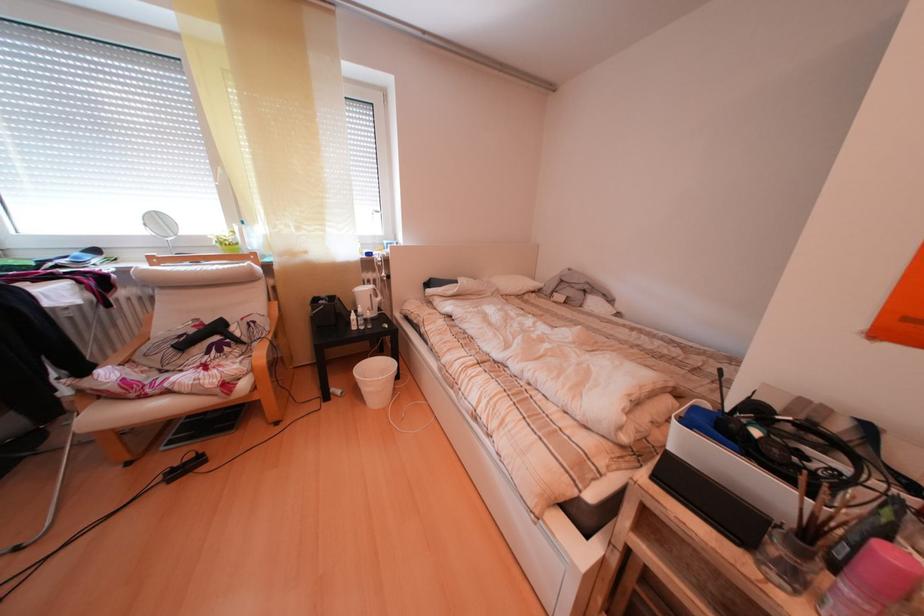
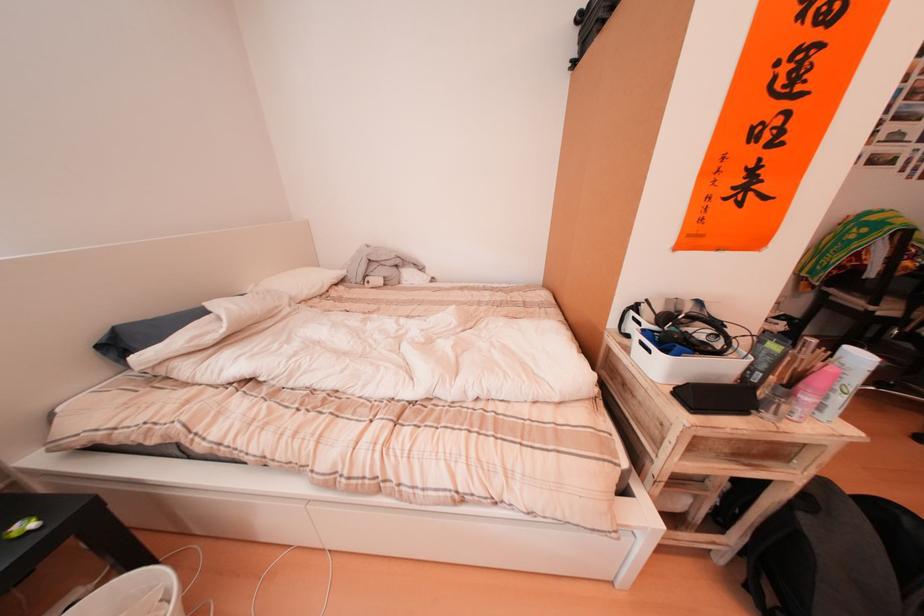
In the second image, find the point that corresponds to pixel 853 432 in the first image.

(700, 313)